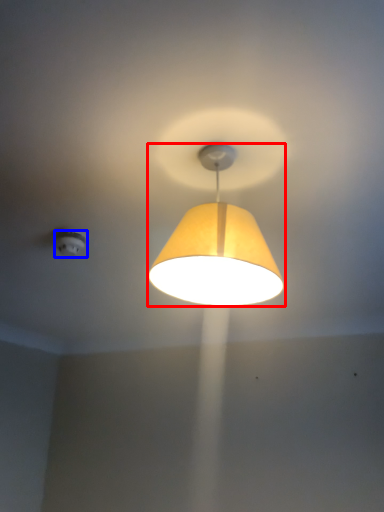
Question: Which of the following is the closest to the observer, lamp (highlighted by a red box) or lighting (highlighted by a blue box)?

Choices:
 (A) lamp
 (B) lighting

Answer: (A)